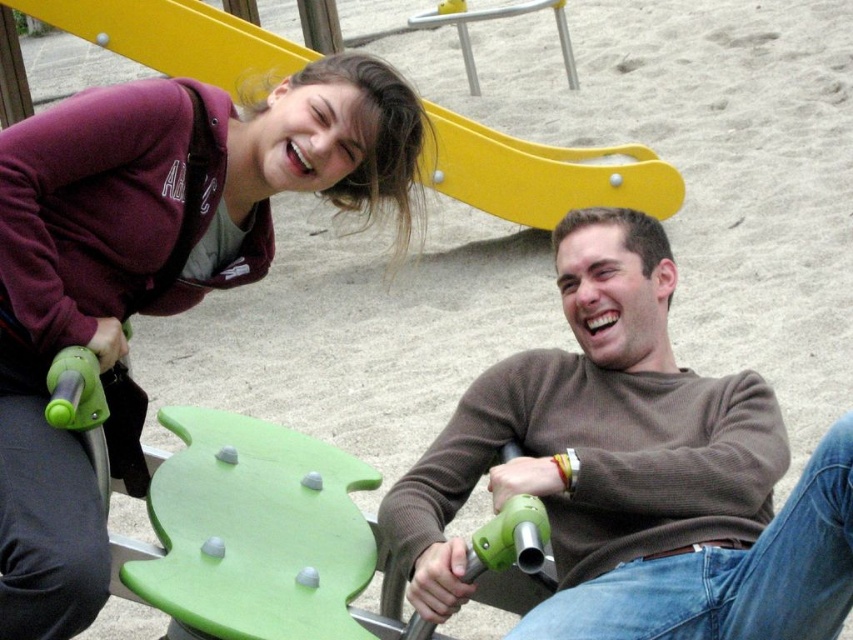
Who is higher up, brown textured sweater at center or yellow matte slide at upper center?

yellow matte slide at upper center

Between brown textured sweater at center and yellow matte slide at upper center, which one has less height?

With less height is yellow matte slide at upper center.

Which is behind, point (689, 412) or point (595, 177)?

The point (595, 177) is behind.

Image resolution: width=853 pixels, height=640 pixels. Identify the location of brown textured sweater at center. (x=635, y=472).

Between brown textured sweater at center and maroon fleece jacket at upper left, which one is positioned higher?

maroon fleece jacket at upper left is above.

Is brown textured sweater at center in front of maroon fleece jacket at upper left?

No.

Which is behind, point (834, 596) or point (289, 173)?

The point (289, 173) is more distant.

The image size is (853, 640). Identify the location of brown textured sweater at center. (635, 472).

Between maroon fleece jacket at upper left and yellow matte slide at upper center, which one appears on the right side from the viewer's perspective?

Positioned to the right is maroon fleece jacket at upper left.

How distant is maroon fleece jacket at upper left from yellow matte slide at upper center?

maroon fleece jacket at upper left is 7.70 meters away from yellow matte slide at upper center.

I want to click on maroon fleece jacket at upper left, so click(x=149, y=272).

In order to click on maroon fleece jacket at upper left in this screenshot , I will do `click(149, 272)`.